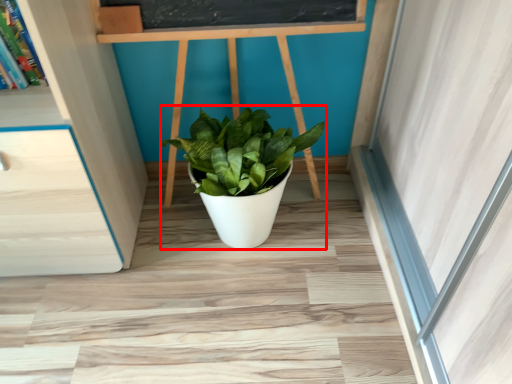
Question: From the image's perspective, where is houseplant (annotated by the red box) located relative to shelf?

Choices:
 (A) below
 (B) above

Answer: (A)